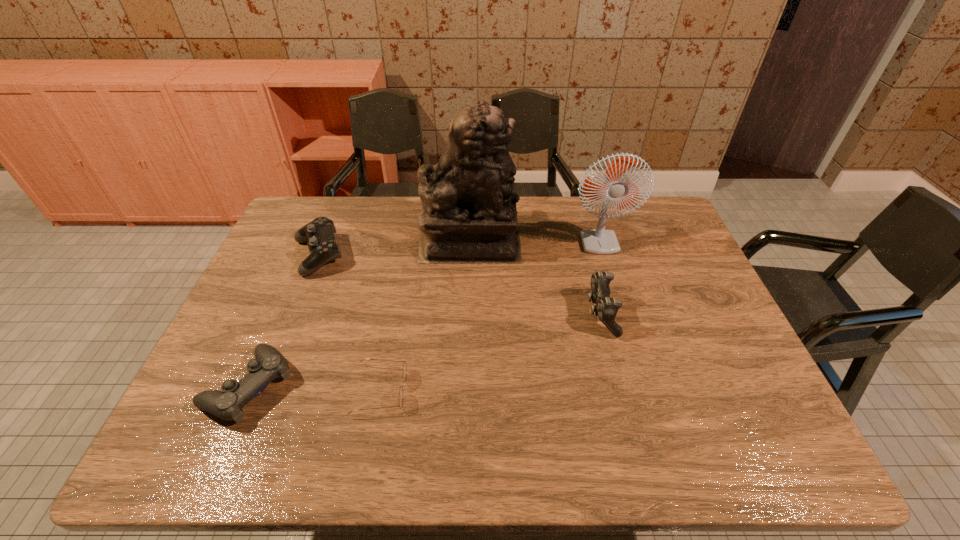
Image resolution: width=960 pixels, height=540 pixels. I want to click on object that is the second closest to the second farthest control, so click(x=469, y=215).

Identify which object is the fourth closest to the tallest control. Please provide its 2D coordinates. Your answer should be formatted as a tuple, i.e. [(x, y)], where the tuple contains the x and y coordinates of a point satisfying the conditions above.

[(319, 234)]

Identify which control is the second nearest to the shortest control. Please provide its 2D coordinates. Your answer should be formatted as a tuple, i.e. [(x, y)], where the tuple contains the x and y coordinates of a point satisfying the conditions above.

[(606, 308)]

Select which control is the closest to the third nearest object. Please provide its 2D coordinates. Your answer should be formatted as a tuple, i.e. [(x, y)], where the tuple contains the x and y coordinates of a point satisfying the conditions above.

[(319, 234)]

Locate an element on the screen. The image size is (960, 540). vacant space that satisfies the following two spatial constraints: 1. on the front-facing side of the fan; 2. on the surface of the rightmost control with buttons is located at coordinates (639, 314).

Where is `blank area in the image that satisfies the following two spatial constraints: 1. on the front-facing side of the second tallest object; 2. on the surface of the fourth farthest object with buttons`? The width and height of the screenshot is (960, 540). blank area in the image that satisfies the following two spatial constraints: 1. on the front-facing side of the second tallest object; 2. on the surface of the fourth farthest object with buttons is located at coordinates (639, 314).

Identify the location of vacant space that satisfies the following two spatial constraints: 1. on the front-facing side of the fan; 2. on the surface of the second nearest control with buttons. (639, 314).

Locate an element on the screen. free space that satisfies the following two spatial constraints: 1. on the front-facing side of the second tallest object; 2. on the surface of the rightmost control with buttons is located at coordinates (639, 314).

Locate an element on the screen. Image resolution: width=960 pixels, height=540 pixels. free space that satisfies the following two spatial constraints: 1. on the front-facing side of the fan; 2. on the surface of the third tallest object with buttons is located at coordinates (639, 314).